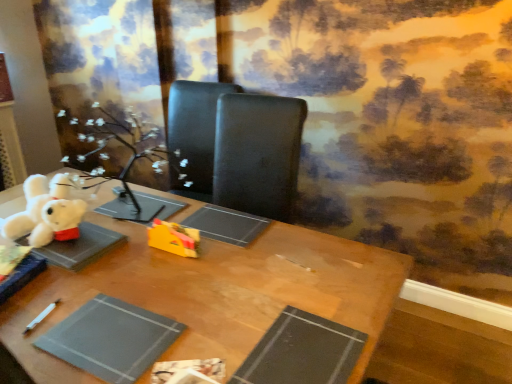
You are a GUI agent. You are given a task and a screenshot of the screen. Output one action in this format:
    pyautogui.click(x=<x>, y=<y>)
    Task: Click on the free space to the left of black matte paperback book at lower center, which is counted as the 1th paperback book, starting from the right
    The width and height of the screenshot is (512, 384).
    Given the screenshot: What is the action you would take?
    pyautogui.click(x=199, y=325)